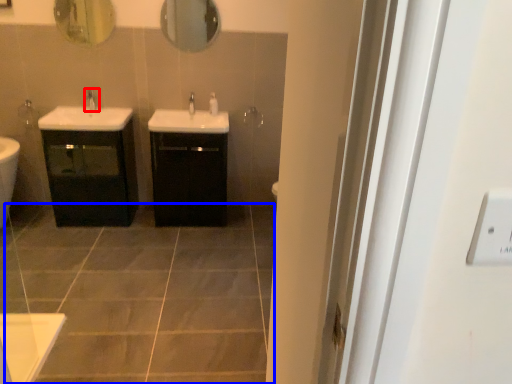
Question: Which object appears farthest to the camera in this image, tap (highlighted by a red box) or ceramic tile (highlighted by a blue box)?

Choices:
 (A) tap
 (B) ceramic tile

Answer: (A)